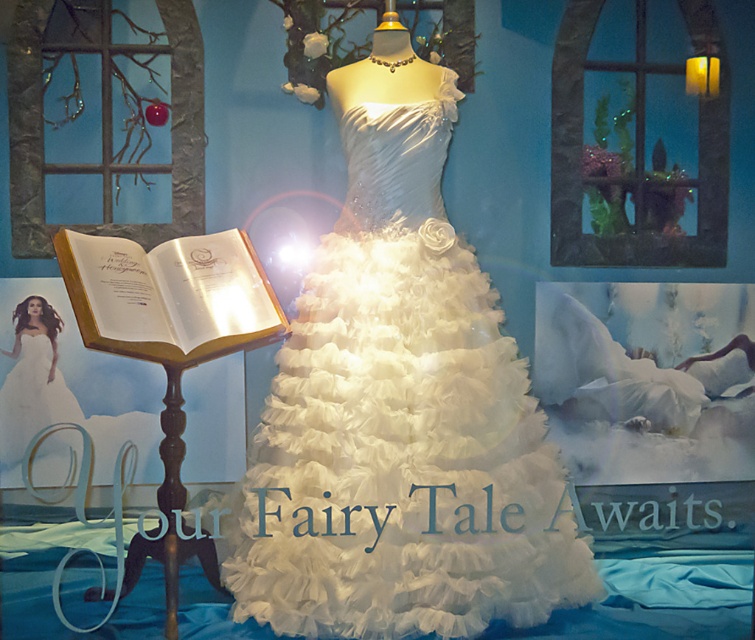
Question: Which object appears farthest from the camera in this image?

Choices:
 (A) white paper book at left
 (B) translucent glass at upper right

Answer: (B)

Question: Does translucent glass at upper right have a smaller size compared to white tulle dress at left?

Choices:
 (A) yes
 (B) no

Answer: (B)

Question: Which of the following is the farthest from the observer?

Choices:
 (A) white fluffy dress at center
 (B) translucent glass at upper right
 (C) white tulle dress at left
 (D) white paper book at left

Answer: (A)

Question: Estimate the real-world distances between objects in this image. Which object is farther from the translucent glass at upper right?

Choices:
 (A) white tulle dress at center
 (B) white tulle dress at left

Answer: (B)

Question: Where is white paper book at left located in relation to white tulle dress at left in the image?

Choices:
 (A) below
 (B) above

Answer: (B)

Question: Can you confirm if white tulle dress at center is wider than white paper book at left?

Choices:
 (A) no
 (B) yes

Answer: (B)